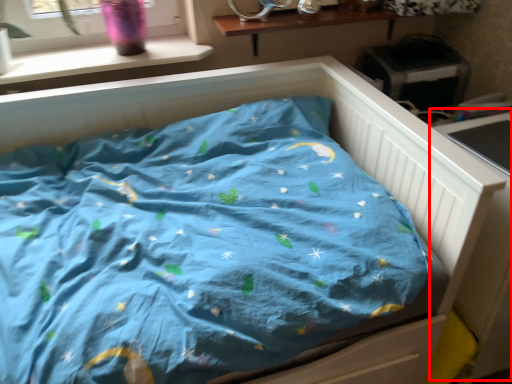
Question: Considering the relative positions of table (annotated by the red box) and window sill in the image provided, where is table (annotated by the red box) located with respect to the staircase?

Choices:
 (A) left
 (B) right

Answer: (B)